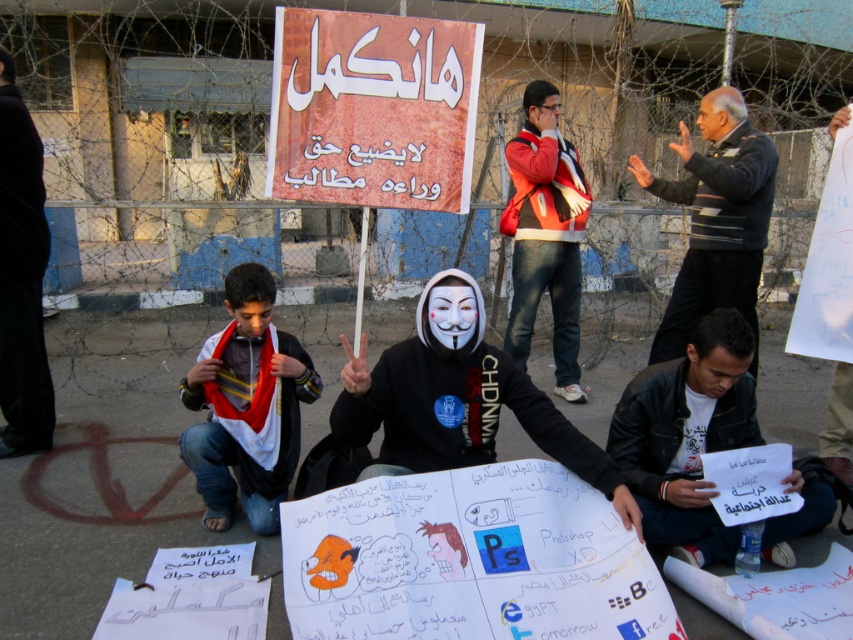
Question: Does leather jacket at lower right lie in front of striped sweater at center?

Choices:
 (A) yes
 (B) no

Answer: (A)

Question: Based on their relative distances, which object is farther from the red jacket at center?

Choices:
 (A) leather jacket at lower right
 (B) black fabric pants at lower left
 (C) striped sweater at center

Answer: (B)

Question: Is the position of leather jacket at lower right less distant than that of striped sweater at center?

Choices:
 (A) yes
 (B) no

Answer: (A)

Question: Does striped sweater at center have a larger size compared to red jacket at center?

Choices:
 (A) no
 (B) yes

Answer: (A)

Question: Which object is closer to the camera taking this photo?

Choices:
 (A) red jacket at center
 (B) black fabric pants at lower left
 (C) striped sweater at center

Answer: (B)

Question: Among these points, which one is nearest to the camera?

Choices:
 (A) (32, 289)
 (B) (798, 483)

Answer: (B)